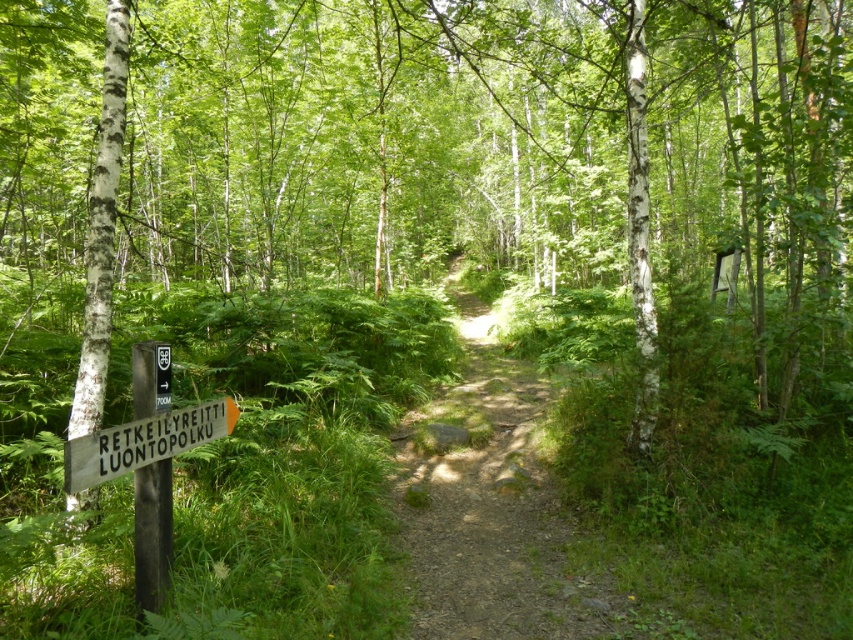
Question: Observing the image, what is the correct spatial positioning of dirt path at center in reference to wooden sign at lower left?

Choices:
 (A) above
 (B) below

Answer: (B)

Question: Which point appears farthest from the camera in this image?

Choices:
 (A) (93, 260)
 (B) (183, 410)
 (C) (521, 614)

Answer: (C)

Question: Which of the following is the farthest from the observer?

Choices:
 (A) (160, 451)
 (B) (97, 163)
 (C) (532, 481)

Answer: (C)

Question: Can you confirm if dirt path at center is smaller than white smooth birch at left?

Choices:
 (A) yes
 (B) no

Answer: (B)

Question: Which of the following is the closest to the observer?

Choices:
 (A) wooden sign at lower left
 (B) white smooth birch at left
 (C) dirt path at center

Answer: (A)

Question: Does dirt path at center appear on the left side of white smooth birch at left?

Choices:
 (A) no
 (B) yes

Answer: (A)